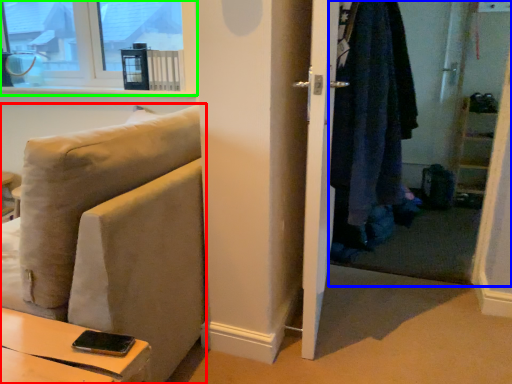
Question: Which is nearer to the studio couch (highlighted by a red box)? closet (highlighted by a blue box) or window (highlighted by a green box).

Choices:
 (A) closet
 (B) window

Answer: (A)